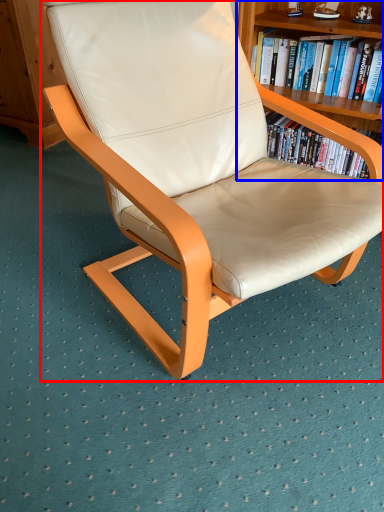
Question: Which of the following is the farthest to the observer, chair (highlighted by a red box) or bookcase (highlighted by a blue box)?

Choices:
 (A) chair
 (B) bookcase

Answer: (B)